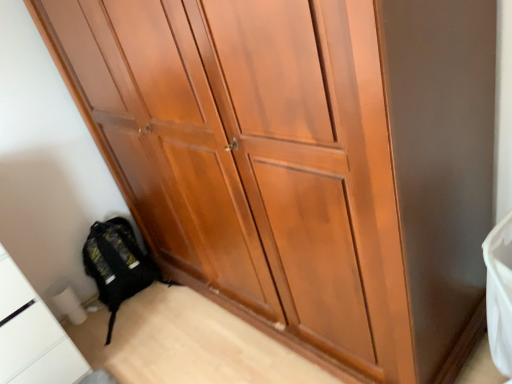
At what (x,y) coordinates should I click in order to perform the action: click on free space on the front side of black fabric backpack at lower left. Please return your answer as a coordinate pair (x, y). This screenshot has height=384, width=512. Looking at the image, I should click on (139, 347).